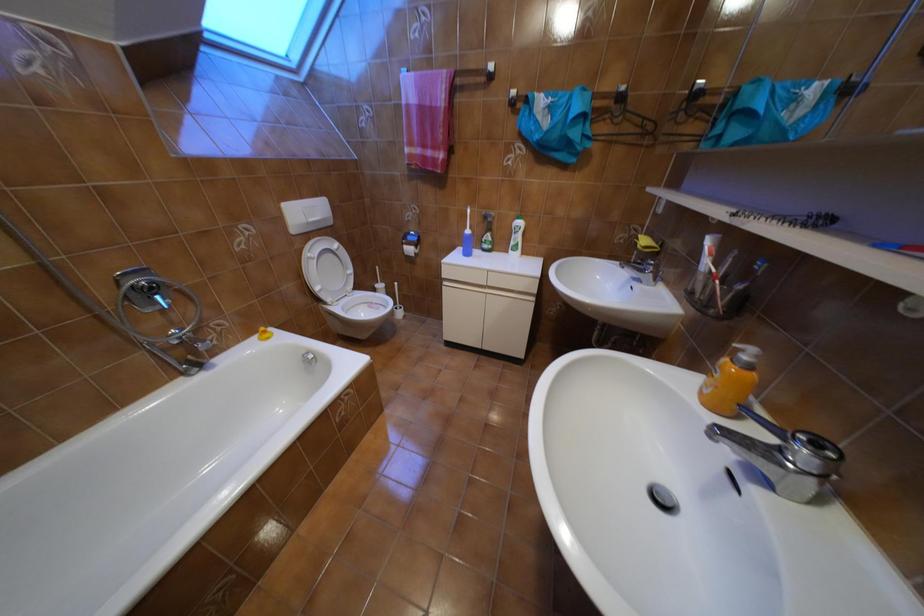
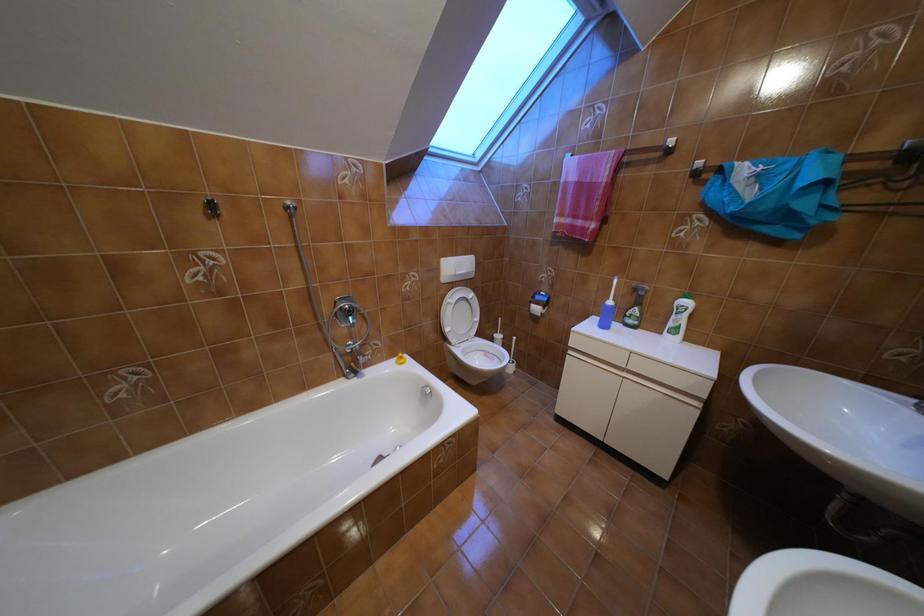
Question: Based on the continuous images, in which direction is the camera rotating? Reply with the corresponding letter.

Choices:
 (A) Left
 (B) Right
 (C) Up
 (D) Down

Answer: (A)